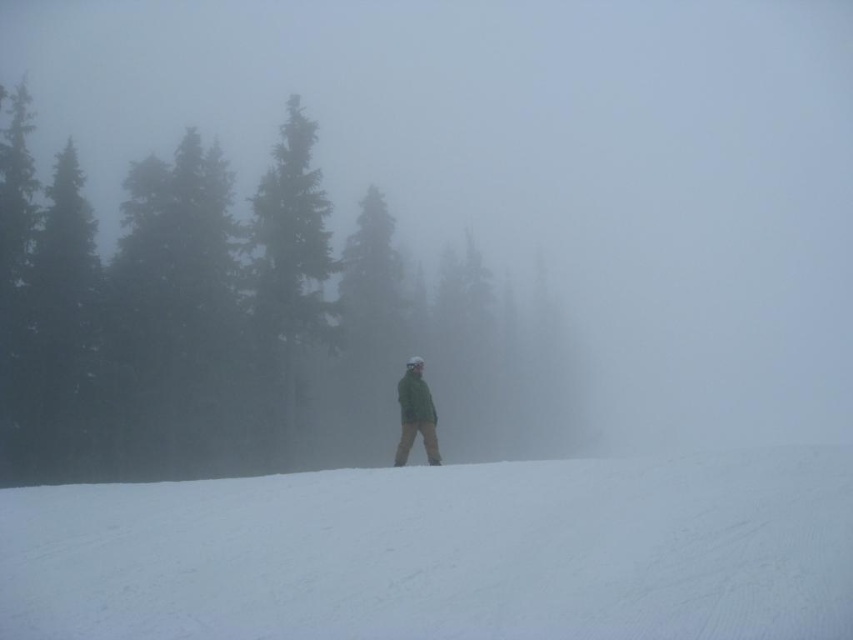
Question: Which object is positioned closest to the white snow at center?

Choices:
 (A) green matte tree at center
 (B) green textured pine tree at upper left

Answer: (A)

Question: Is green matte tree at center above green textured pine tree at upper left?

Choices:
 (A) yes
 (B) no

Answer: (B)

Question: Observing the image, what is the correct spatial positioning of white snow at center in reference to green textured pine tree at upper left?

Choices:
 (A) above
 (B) below

Answer: (B)

Question: Among these objects, which one is nearest to the camera?

Choices:
 (A) green matte tree at center
 (B) green textured pine tree at upper left

Answer: (A)

Question: Is green textured pine tree at upper left below green matte jacket at center?

Choices:
 (A) no
 (B) yes

Answer: (A)

Question: Which is farther from the white snow at center?

Choices:
 (A) green matte jacket at center
 (B) green matte tree at center

Answer: (B)